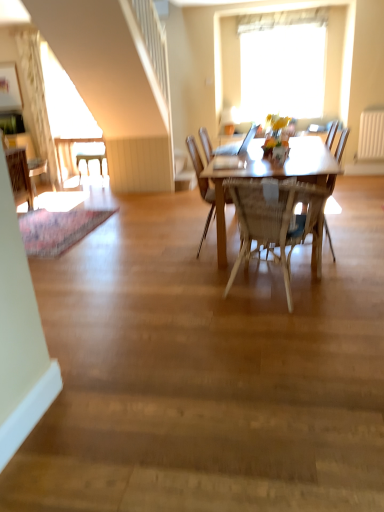
Question: Is wooden chair at left, the 2th chair positioned from the back, in contact with matte white vase at center?

Choices:
 (A) no
 (B) yes

Answer: (A)

Question: Is matte white vase at center inside wooden chair at left, the fourth chair from the right?

Choices:
 (A) yes
 (B) no

Answer: (B)

Question: From a real-world perspective, is wooden chair at left, which is counted as the 2th chair, starting from the left, physically below matte white vase at center?

Choices:
 (A) no
 (B) yes

Answer: (B)

Question: Can you confirm if wooden chair at left, which is counted as the 2th chair, starting from the left, is positioned to the right of matte white vase at center?

Choices:
 (A) no
 (B) yes

Answer: (A)

Question: From the image's perspective, does wooden chair at left, the 4th chair positioned from the front, appear higher than matte white vase at center?

Choices:
 (A) no
 (B) yes

Answer: (B)

Question: Relative to transparent glass window at upper center, is light brown wooden table at center in front or behind?

Choices:
 (A) front
 (B) behind

Answer: (A)

Question: In the image, is light brown wooden table at center on the left side or the right side of transparent glass window at upper center?

Choices:
 (A) left
 (B) right

Answer: (A)

Question: Considering the positions of light brown wooden table at center and transparent glass window at upper center in the image, is light brown wooden table at center taller or shorter than transparent glass window at upper center?

Choices:
 (A) tall
 (B) short

Answer: (B)

Question: From a real-world perspective, is light brown wooden table at center positioned above or below transparent glass window at upper center?

Choices:
 (A) below
 (B) above

Answer: (A)

Question: From a real-world perspective, is wooden chair at left, which appears as the 1th chair when viewed from the left, above or below woven wood chair at center, marked as the 5th chair in a back-to-front arrangement?

Choices:
 (A) below
 (B) above

Answer: (B)

Question: Is wooden chair at left, which appears as the 1th chair when viewed from the left, bigger or smaller than woven wood chair at center, which appears as the 1th chair when viewed from the front?

Choices:
 (A) big
 (B) small

Answer: (B)

Question: Is point (28, 206) positioned closer to the camera than point (294, 242)?

Choices:
 (A) farther
 (B) closer

Answer: (A)

Question: In terms of width, does wooden chair at left, which is counted as the 3th chair, starting from the back, look wider or thinner when compared to woven wood chair at center, the 2th chair viewed from the right?

Choices:
 (A) thin
 (B) wide

Answer: (A)

Question: Considering the positions of white glossy desk at left and white plastic radiator at right in the image, is white glossy desk at left wider or thinner than white plastic radiator at right?

Choices:
 (A) thin
 (B) wide

Answer: (B)

Question: Considering the positions of white glossy desk at left and white plastic radiator at right in the image, is white glossy desk at left bigger or smaller than white plastic radiator at right?

Choices:
 (A) small
 (B) big

Answer: (B)